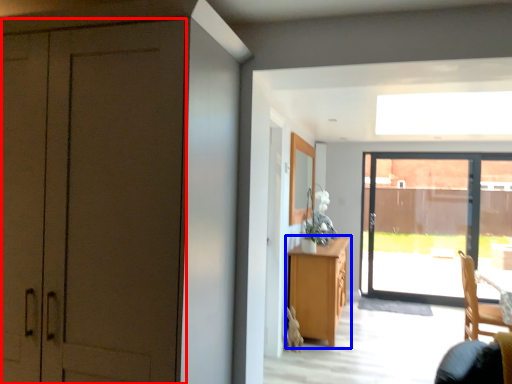
Question: Which object is further to the camera taking this photo, door (highlighted by a red box) or cabinetry (highlighted by a blue box)?

Choices:
 (A) door
 (B) cabinetry

Answer: (B)